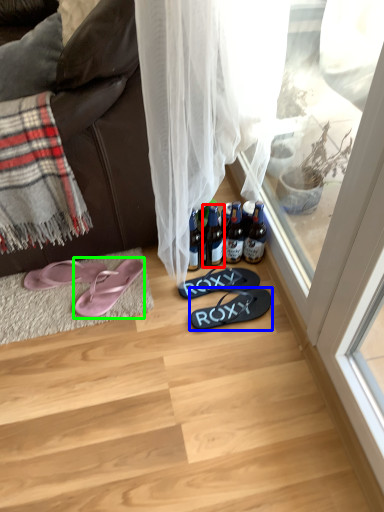
Question: Which object is positioned closest to bottle (highlighted by a red box)? Select from footwear (highlighted by a blue box) and footwear (highlighted by a green box).

Choices:
 (A) footwear
 (B) footwear

Answer: (A)